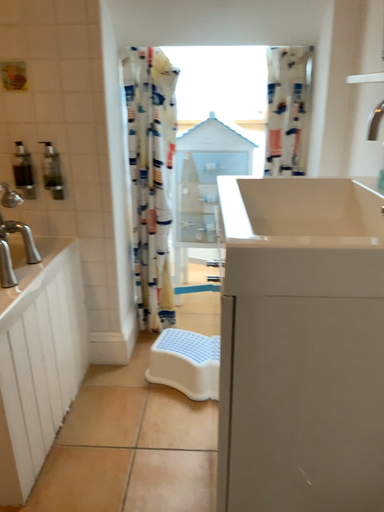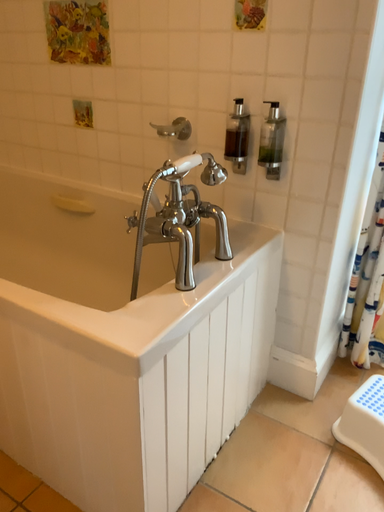
Question: How did the camera likely rotate when shooting the video?

Choices:
 (A) rotated left
 (B) rotated right

Answer: (A)